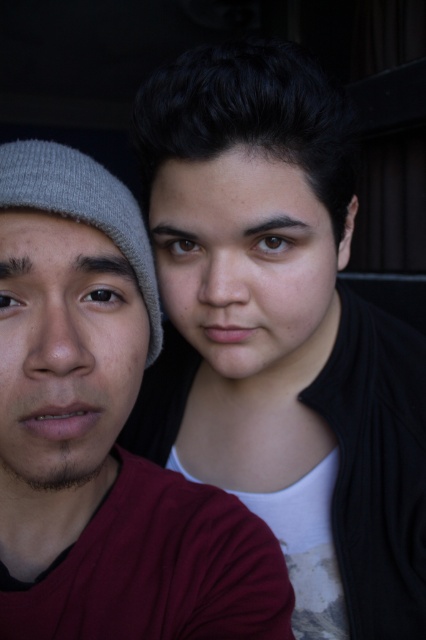
Consider the image. Is matte black hair at upper center smaller than matte gray beanie at left?

Actually, matte black hair at upper center might be larger than matte gray beanie at left.

Which is more to the right, matte black hair at upper center or matte gray beanie at left?

matte black hair at upper center

Between point (216, 164) and point (14, 227), which one is positioned in front?

Positioned in front is point (14, 227).

Locate an element on the screen. The image size is (426, 640). matte black hair at upper center is located at coordinates (279, 316).

Between matte gray beanie at left and gray knit beanie at left, which one is positioned lower?

Positioned lower is matte gray beanie at left.

Is point (282, 614) more distant than point (108, 177)?

That is False.

Identify the location of matte gray beanie at left. (103, 435).

Where is `matte black hair at upper center`? The image size is (426, 640). matte black hair at upper center is located at coordinates (279, 316).

Is matte black hair at upper center bigger than gray knit beanie at left?

Indeed, matte black hair at upper center has a larger size compared to gray knit beanie at left.

Which is behind, point (351, 202) or point (14, 196)?

The point (351, 202) is behind.

Identify the location of matte black hair at upper center. The height and width of the screenshot is (640, 426). (279, 316).